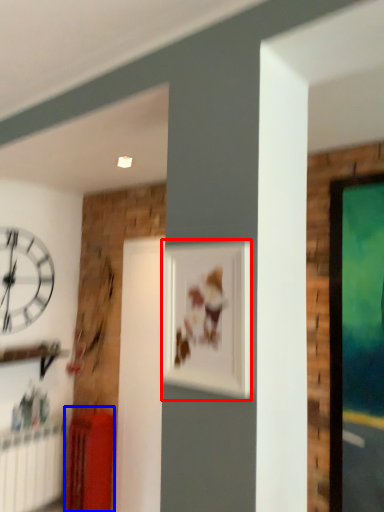
Question: Which object is closer to the camera taking this photo, picture frame (highlighted by a red box) or furniture (highlighted by a blue box)?

Choices:
 (A) picture frame
 (B) furniture

Answer: (A)